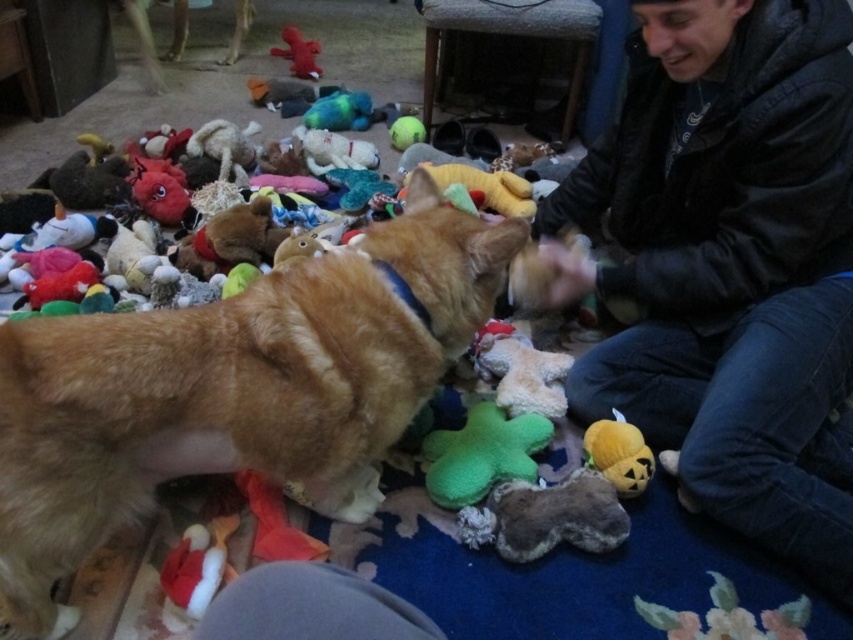
You are a dog owner who wants to fetch the green fuzzy star at center and the velvet pumpkin plush at lower center. Based on their positions, which toy should you reach for first?

The green fuzzy star at center is closer to the viewer than the velvet pumpkin plush at lower center, so you should reach for the green fuzzy star at center first.